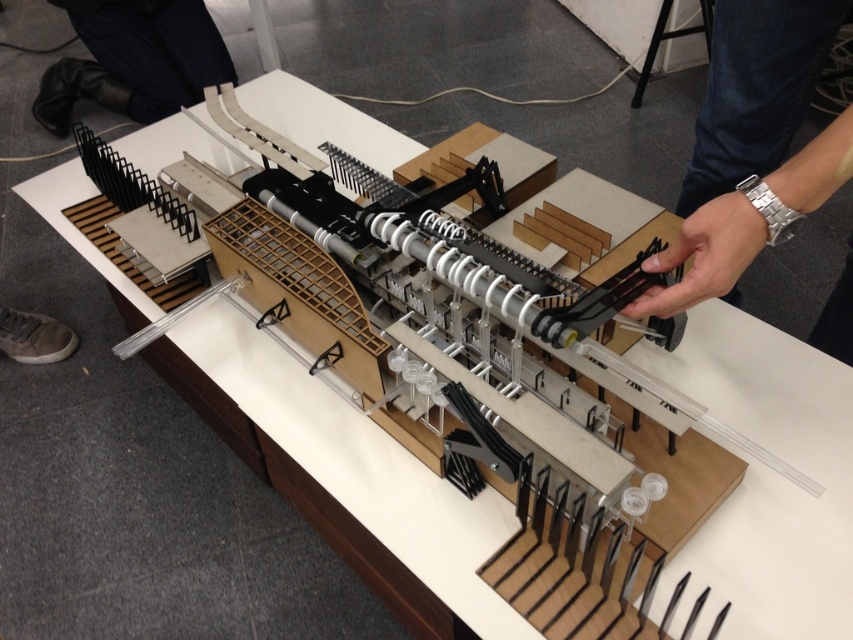
Is point (779, 35) farther from viewer compared to point (128, 106)?

No, it is not.

Does silver metallic wristwatch at upper right come in front of black leather pants at upper left?

Yes, it is.

Does point (718, 285) come in front of point (142, 115)?

That is True.

You are a GUI agent. You are given a task and a screenshot of the screen. Output one action in this format:
    pyautogui.click(x=<x>, y=<y>)
    Task: Click on the silver metallic wristwatch at upper right
    
    Given the screenshot: What is the action you would take?
    pyautogui.click(x=752, y=144)